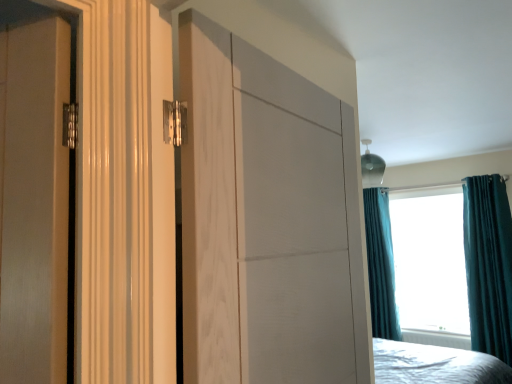
Identify the location of teal velvet curtain at right, which is the 2th curtain in left-to-right order. The image size is (512, 384). (488, 264).

What do you see at coordinates (437, 338) in the screenshot? I see `white plastic radiator at lower center` at bounding box center [437, 338].

Locate an element on the screen. teal velvet curtain at right, the 1th curtain positioned from the back is located at coordinates (380, 265).

The image size is (512, 384). I want to click on teal velvet curtain at right, the first curtain positioned from the right, so click(x=488, y=264).

Can you tell me how much teal velvet curtain at upper right and white plastic radiator at lower center differ in facing direction?

0.000498 degrees.

From a real-world perspective, is teal velvet curtain at upper right beneath white plastic radiator at lower center?

Actually, teal velvet curtain at upper right is physically above white plastic radiator at lower center in the real world.

Which is closer to the camera, (472, 247) or (432, 340)?

Point (472, 247)

Measure the distance from teal velvet curtain at upper right to white plastic radiator at lower center.

They are 22.35 inches apart.

Would you say white plastic radiator at lower center is a long distance from teal velvet curtain at upper right?

white plastic radiator at lower center is near teal velvet curtain at upper right, not far away.

From the image's perspective, is white plastic radiator at lower center below teal velvet curtain at upper right?

Yes.

Is white plastic radiator at lower center facing towards teal velvet curtain at upper right?

No.

From the image's perspective, which one is positioned lower, teal velvet curtain at right, positioned as the second curtain in back-to-front order, or teal velvet curtain at right, the 1th curtain positioned from the back?

From the image's view, teal velvet curtain at right, the 1th curtain positioned from the back, is below.

Locate an element on the screen. Image resolution: width=512 pixels, height=384 pixels. curtain above the teal velvet curtain at right, which is the 2th curtain in left-to-right order (from a real-world perspective) is located at coordinates (380, 265).

Does point (501, 181) appear closer or farther from the camera than point (376, 219)?

Point (501, 181) is positioned closer to the camera compared to point (376, 219).

Considering their positions, is teal velvet curtain at right, positioned as the second curtain in back-to-front order, located in front of or behind teal velvet curtain at right, the 1th curtain positioned from the back?

Clearly, teal velvet curtain at right, positioned as the second curtain in back-to-front order, is in front of teal velvet curtain at right, the 1th curtain positioned from the back.

Is teal velvet curtain at upper right not within teal velvet curtain at right, the first curtain positioned from the right?

Absolutely, teal velvet curtain at upper right is external to teal velvet curtain at right, the first curtain positioned from the right.

From the image's perspective, which object appears higher, teal velvet curtain at upper right or teal velvet curtain at right, positioned as the second curtain in back-to-front order?

From the image's view, teal velvet curtain at upper right is above.

Is teal velvet curtain at upper right far from teal velvet curtain at right, arranged as the 1th curtain when viewed from the front?

No, teal velvet curtain at upper right is not far away from teal velvet curtain at right, arranged as the 1th curtain when viewed from the front.

Does teal velvet curtain at upper right have a smaller size compared to white wood door at center?

No.

Which point is more distant from viewer, [489,187] or [344,235]?

The point [489,187] is farther from the camera.

Which is correct: teal velvet curtain at upper right is inside white wood door at center, or outside of it?

teal velvet curtain at upper right lies outside white wood door at center.

Could you tell me if teal velvet curtain at upper right is turned towards white wood door at center?

Yes, teal velvet curtain at upper right faces towards white wood door at center.

Which is behind, point (312, 107) or point (387, 332)?

Positioned behind is point (387, 332).

Considering the sizes of objects white wood door at center and teal velvet curtain at upper right in the image provided, who is shorter, white wood door at center or teal velvet curtain at upper right?

white wood door at center.

Is white wood door at center surrounding teal velvet curtain at upper right?

No.

Considering the relative positions of white wood door at center and teal velvet curtain at upper right in the image provided, is white wood door at center to the left of teal velvet curtain at upper right from the viewer's perspective?

Yes.

Does white plastic radiator at lower center turn towards teal velvet curtain at right, the first curtain positioned from the right?

No, white plastic radiator at lower center is not aimed at teal velvet curtain at right, the first curtain positioned from the right.

From the image's perspective, is white plastic radiator at lower center beneath teal velvet curtain at right, arranged as the 1th curtain when viewed from the front?

Yes, from the image's perspective, white plastic radiator at lower center is beneath teal velvet curtain at right, arranged as the 1th curtain when viewed from the front.

Are white plastic radiator at lower center and teal velvet curtain at right, positioned as the second curtain in back-to-front order, beside each other?

They are not placed beside each other.

Is white plastic radiator at lower center to the left of teal velvet curtain at right, which is the 2th curtain in left-to-right order, from the viewer's perspective?

Indeed, white plastic radiator at lower center is positioned on the left side of teal velvet curtain at right, which is the 2th curtain in left-to-right order.

Image resolution: width=512 pixels, height=384 pixels. I want to click on radiator on the left of teal velvet curtain at upper right, so click(x=437, y=338).

I want to click on radiator in front of the teal velvet curtain at upper right, so click(437, 338).

When comparing their distances from white plastic radiator at lower center, does teal velvet curtain at upper right or teal velvet curtain at right, which is the 2th curtain in left-to-right order, seem further?

teal velvet curtain at right, which is the 2th curtain in left-to-right order, is positioned further to the anchor white plastic radiator at lower center.

Considering their positions, is teal velvet curtain at upper right positioned closer to teal velvet curtain at right, which is counted as the first curtain, starting from the left, than white wood door at center?

teal velvet curtain at upper right.

Which object lies further to the anchor point white wood door at center, teal velvet curtain at upper right or teal velvet curtain at right, which is the 2th curtain in left-to-right order?

Among the two, teal velvet curtain at upper right is located further to white wood door at center.

Considering their positions, is white wood door at center positioned further to white plastic radiator at lower center than teal velvet curtain at upper right?

white wood door at center is further to white plastic radiator at lower center.

Based on their spatial positions, is teal velvet curtain at right, positioned as the second curtain in back-to-front order, or teal velvet curtain at upper right further from teal velvet curtain at right, which is the second curtain in front-to-back order?

Among the two, teal velvet curtain at right, positioned as the second curtain in back-to-front order, is located further to teal velvet curtain at right, which is the second curtain in front-to-back order.

When comparing their distances from teal velvet curtain at upper right, does teal velvet curtain at right, which is counted as the first curtain, starting from the left, or white wood door at center seem closer?

Among the two, teal velvet curtain at right, which is counted as the first curtain, starting from the left, is located nearer to teal velvet curtain at upper right.

Based on their spatial positions, is white wood door at center or teal velvet curtain at right, which is the second curtain in front-to-back order, closer to white plastic radiator at lower center?

teal velvet curtain at right, which is the second curtain in front-to-back order, lies closer to white plastic radiator at lower center than the other object.

Considering their positions, is white plastic radiator at lower center positioned closer to white wood door at center than teal velvet curtain at right, the first curtain positioned from the right?

Among the two, teal velvet curtain at right, the first curtain positioned from the right, is located nearer to white wood door at center.

This screenshot has width=512, height=384. Identify the location of curtain between white wood door at center and white plastic radiator at lower center in the front-back direction. (488, 264).

Where is `radiator between white wood door at center and teal velvet curtain at right, which is the second curtain in front-to-back order, from front to back`? The width and height of the screenshot is (512, 384). radiator between white wood door at center and teal velvet curtain at right, which is the second curtain in front-to-back order, from front to back is located at coordinates (437, 338).

Identify the location of window positioned between teal velvet curtain at right, positioned as the second curtain in back-to-front order, and teal velvet curtain at right, the 2th curtain viewed from the right, from near to far. This screenshot has height=384, width=512. (381, 265).

I want to click on radiator between white wood door at center and teal velvet curtain at upper right from front to back, so click(x=437, y=338).